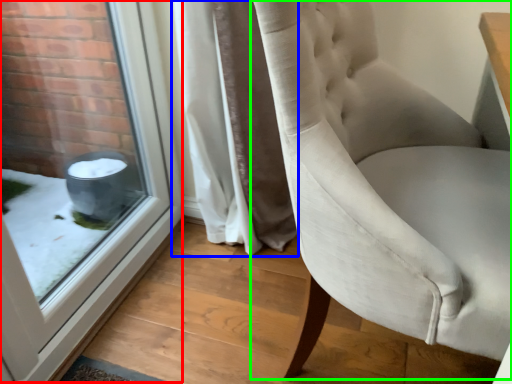
Question: Which object is positioned farthest from window (highlighted by a red box)? Select from curtain (highlighted by a blue box) and chair (highlighted by a green box).

Choices:
 (A) curtain
 (B) chair

Answer: (B)